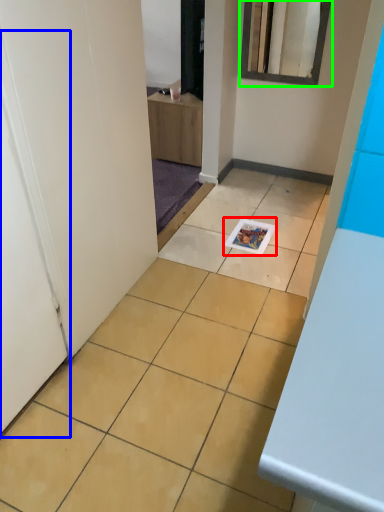
Question: Estimate the real-world distances between objects in this image. Which object is farther from magazine (highlighted by a red box), door (highlighted by a blue box) or mirror (highlighted by a green box)?

Choices:
 (A) door
 (B) mirror

Answer: (A)